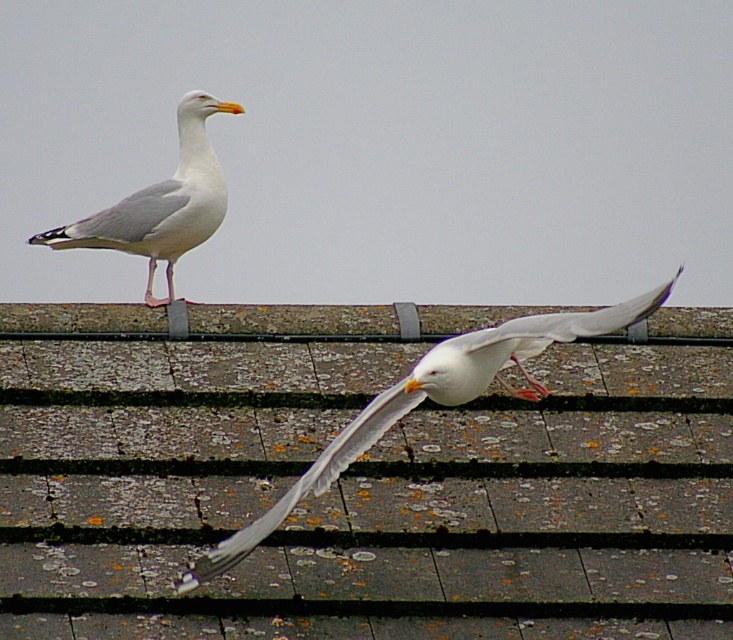
You are standing at the origin point of the image coordinate system. Which object is located at the point with coordinates (432, 401)?

The white feathered bird at center is located at point (432, 401).

You are a birdwatcher observing the scene. You notice two white feathered birds in the image. Which one is positioned closer to you, the white feathered bird at center or the white feathered seagull at upper left?

The white feathered bird at center is closer to the viewer than the white feathered seagull at upper left.

You are standing on the roof and see two birds. Which one is more to the right, the white feathered bird at center or the white feathered seagull at upper left?

The white feathered bird at center is more to the right than the white feathered seagull at upper left.